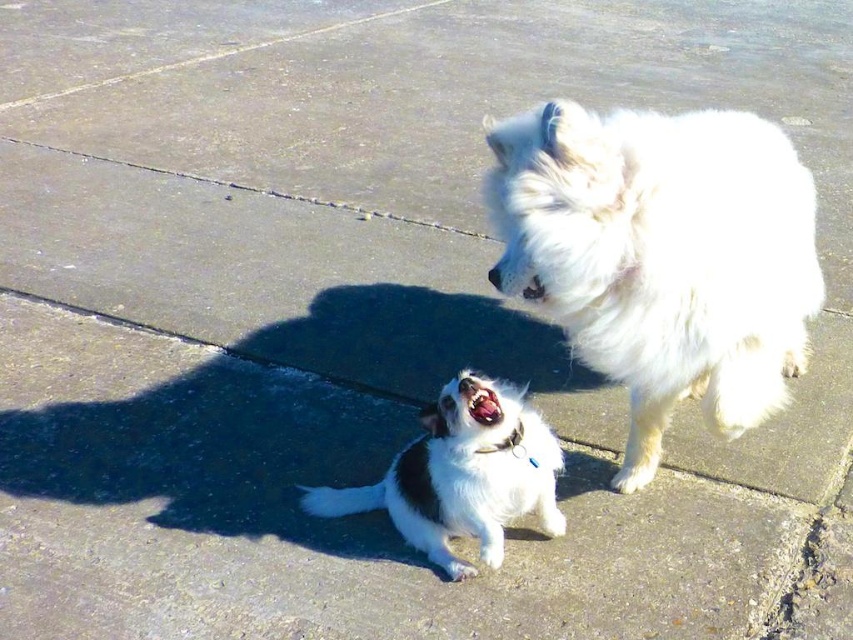
Question: Is white fluffy dog at upper right to the left of white fur dog at center from the viewer's perspective?

Choices:
 (A) no
 (B) yes

Answer: (A)

Question: Among these objects, which one is nearest to the camera?

Choices:
 (A) white fur dog at center
 (B) white fluffy dog at upper right

Answer: (B)

Question: Does white fluffy dog at upper right appear on the left side of white fur dog at center?

Choices:
 (A) yes
 (B) no

Answer: (B)

Question: Which point is closer to the camera?

Choices:
 (A) white fluffy dog at upper right
 (B) white fur dog at center

Answer: (A)

Question: In this image, where is white fluffy dog at upper right located relative to white fur dog at center?

Choices:
 (A) left
 (B) right

Answer: (B)